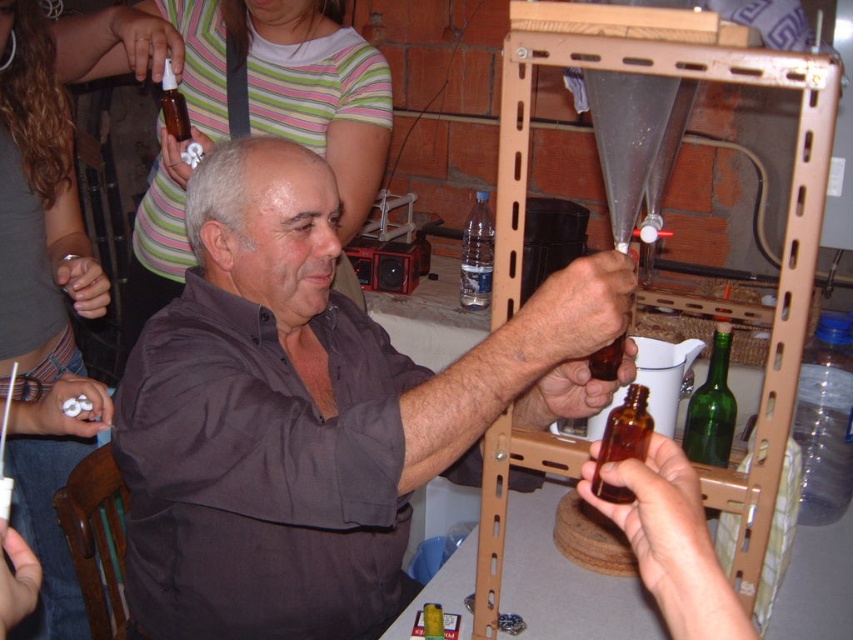
Who is taller, matte brown shirt at center or translucent amber bottle at upper left?

matte brown shirt at center

Who is lower down, matte brown shirt at center or translucent amber bottle at upper left?

matte brown shirt at center is lower down.

Is point (521, 371) positioned after point (163, 84)?

No, (521, 371) is in front of (163, 84).

Identify the location of matte brown shirt at center. (310, 413).

Between brown glass bottle at center and transparent plastic bottle at center, which one is positioned higher?

Positioned higher is transparent plastic bottle at center.

Which is in front, point (627, 420) or point (473, 292)?

Point (627, 420) is more forward.

Is point (610, 442) positioned in front of point (474, 294)?

Yes, it is.

Find the location of a particular element. This screenshot has height=640, width=853. brown glass bottle at center is located at coordinates (624, 442).

Which is more to the left, green glass bottle at center or translucent amber bottle at upper left?

Positioned to the left is translucent amber bottle at upper left.

Describe the element at coordinates (711, 406) in the screenshot. This screenshot has height=640, width=853. I see `green glass bottle at center` at that location.

This screenshot has width=853, height=640. I want to click on green glass bottle at center, so click(711, 406).